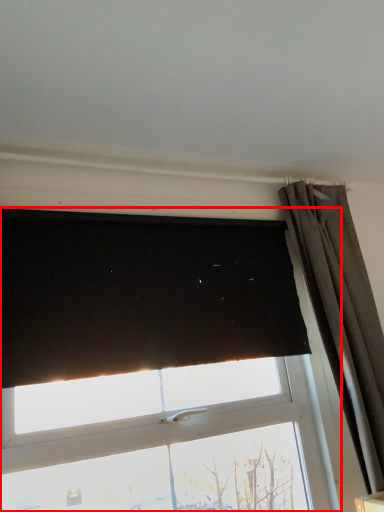
Question: From the image's perspective, considering the relative positions of window (annotated by the red box) and curtain in the image provided, where is window (annotated by the red box) located with respect to the staircase?

Choices:
 (A) above
 (B) below

Answer: (A)